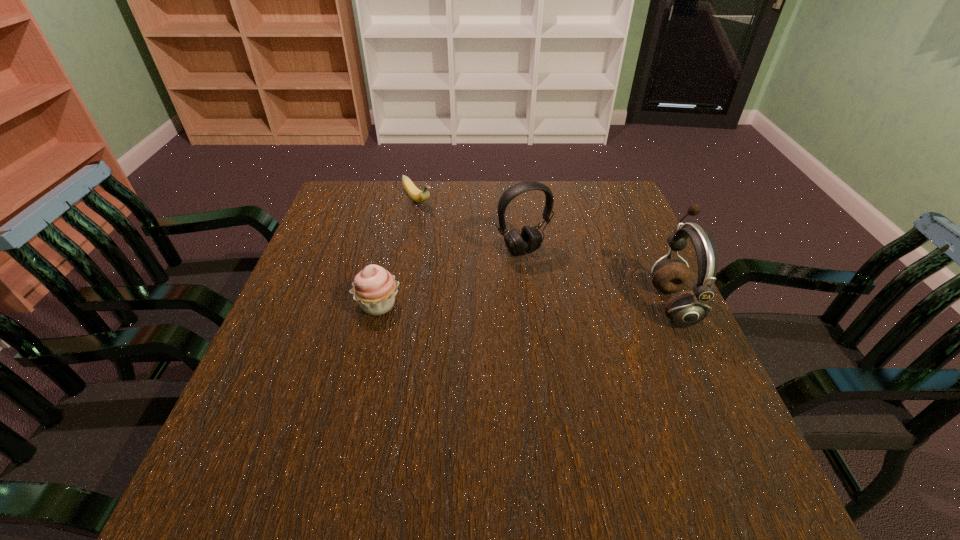
Find the location of `cupcake`. cupcake is located at coordinates (374, 288).

Where is `earphone`? earphone is located at coordinates coord(687,308).

Identify the location of the third object from left to right. This screenshot has width=960, height=540. (530, 240).

I want to click on headset, so click(530, 240).

You are a GUI agent. You are given a task and a screenshot of the screen. Output one action in this format:
    pyautogui.click(x=<x>, y=<y>)
    Task: Click on the farthest object
    
    Given the screenshot: What is the action you would take?
    pyautogui.click(x=414, y=193)

Identify the location of the shortest object. (414, 193).

You are a GUI agent. You are given a task and a screenshot of the screen. Output one action in this format:
    pyautogui.click(x=<x>, y=<y>)
    Task: Click on the vacant space situated 0.100m on the back of the second shortest object
    This screenshot has height=540, width=960.
    Given the screenshot: What is the action you would take?
    pyautogui.click(x=389, y=262)

This screenshot has height=540, width=960. What are the coordinates of `vacant region located 0.310m on the ear pads of the earphone` in the screenshot? It's located at (518, 304).

Find the location of a particular element. This screenshot has height=540, width=960. vacant area located 0.290m on the ear pads of the earphone is located at coordinates (527, 304).

Where is `vacant position located on the ear pads of the earphone`? Image resolution: width=960 pixels, height=540 pixels. vacant position located on the ear pads of the earphone is located at coordinates (549, 304).